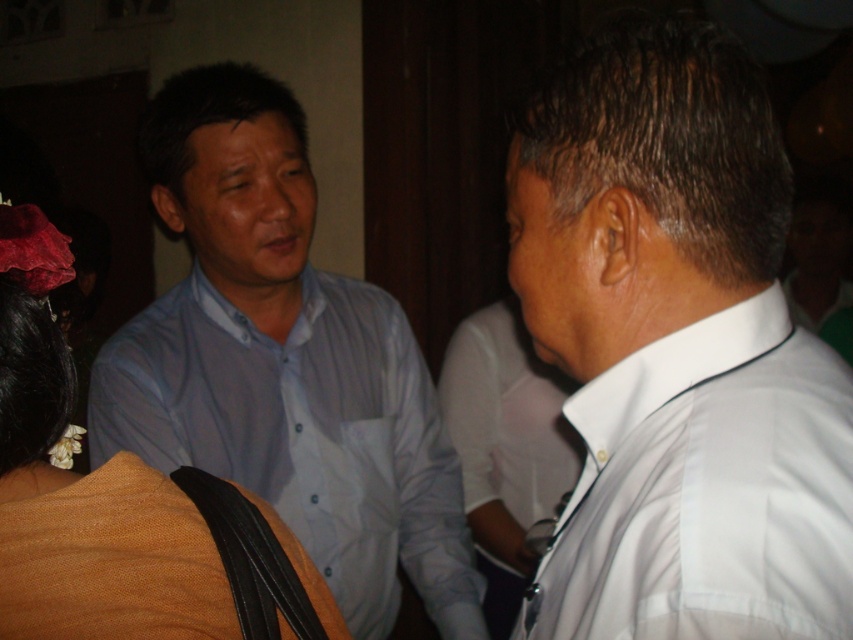
You are standing at the point labeled point (19, 486) in the image. If you want to move towards the point labeled point (397, 403), which direction should you move?

You should move backward because point (397, 403) is behind point (19, 486).

You are at a party and want to find the white smooth shirt at right and the matte orange fabric at lower left. Based on their positions, which one is closer to the entrance of the room?

The white smooth shirt at right is to the right of matte orange fabric at lower left. Since the entrance is typically located near the lower left area, the matte orange fabric at lower left is closer to the entrance.

You are a photographer setting up for a group photo. You notice the white smooth shirt at right and the matte orange fabric at lower left. Which object should you adjust to ensure both are visible in the frame? Explain your reasoning based on their positions.

The white smooth shirt at right is above the matte orange fabric at lower left. To ensure both are visible, adjust the matte orange fabric at lower left to move it upwards or lower the white smooth shirt at right since the shirt is positioned higher in the frame.